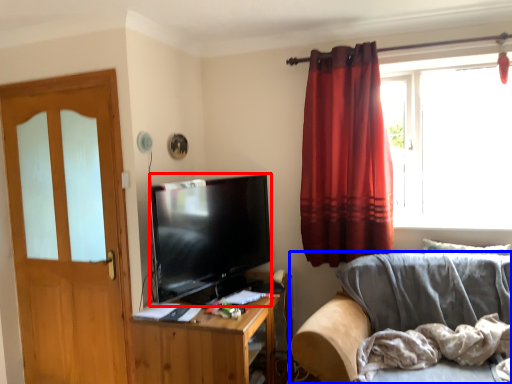
Question: Which of the following is the closest to the observer, television (highlighted by a red box) or studio couch (highlighted by a blue box)?

Choices:
 (A) television
 (B) studio couch

Answer: (B)